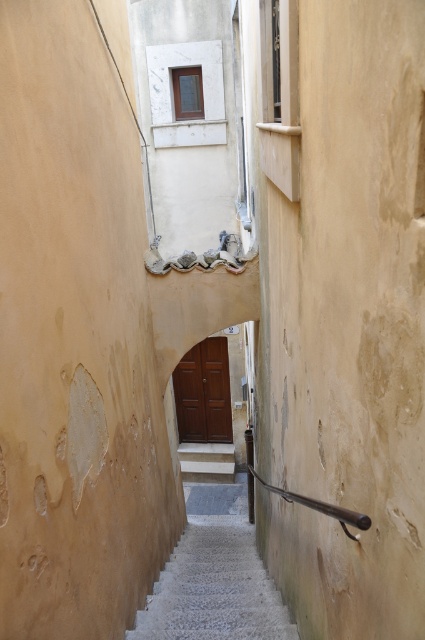
You are standing at the bottom of the alleyway and want to reach the building entrance. The white concrete stairs at center are your only path. If you walk straight towards the building, will you be able to reach the stairs before the alleyway narrows further?

The white concrete stairs at center are 13.59 feet away from your current position. Since the alleyway is narrow and the stairs are the only path forward, you can walk straight towards them without issue before the alleyway narrows further.

You are standing at the bottom of the alleyway and see two points marked on the right wall. The first point is at coordinate point (192, 600) and the second is at point (193, 467). Which point is closer to you as you face the alley?

Point (192, 600) is closer to you because it is in front of point (193, 467).

You are a delivery person carrying a large package and need to walk up the stairs. Which stairs should you take to reach the entrance quickly? The white concrete stairs at center or the white marble stairs at center?

Both the white concrete stairs at center and white marble stairs at center lead to the entrance, but they are 5.11 meters apart from each other. This suggests they are separate staircases, so you should choose the one that is closer to your current position to reach the entrance quickly.